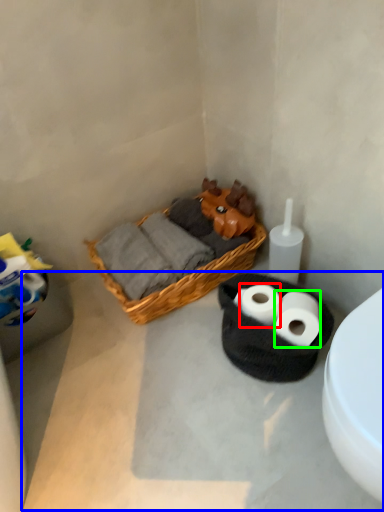
Question: Which is farther away from toilet paper (highlighted by a red box)? concrete (highlighted by a blue box) or toilet paper (highlighted by a green box)?

Choices:
 (A) concrete
 (B) toilet paper

Answer: (A)